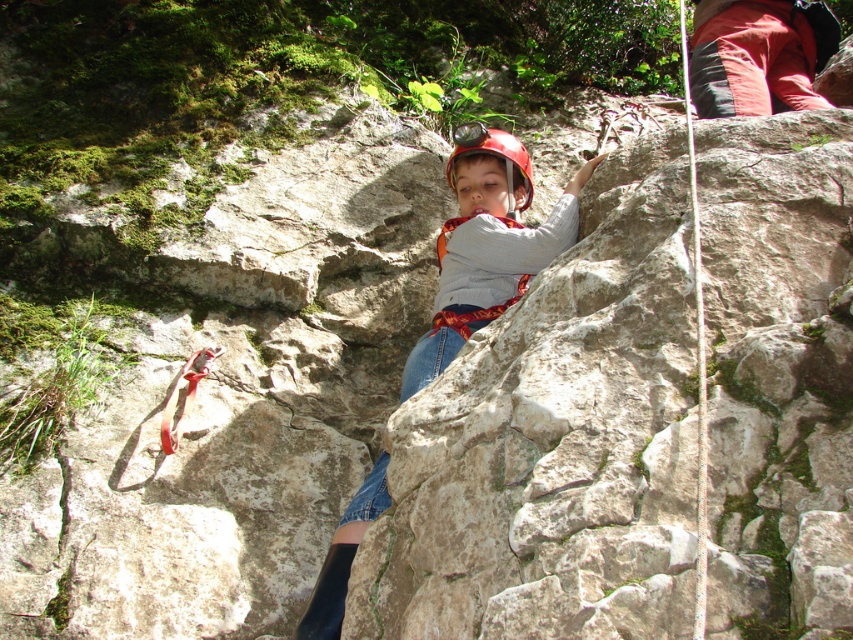
Can you confirm if red fabric jacket at upper right is smaller than red matte helmet at center?

Incorrect, red fabric jacket at upper right is not smaller in size than red matte helmet at center.

Can you confirm if red fabric jacket at upper right is positioned below red matte helmet at center?

No.

At what (x,y) coordinates should I click in order to perform the action: click on red fabric jacket at upper right. Please return your answer as a coordinate pair (x, y). Looking at the image, I should click on click(758, 54).

Image resolution: width=853 pixels, height=640 pixels. I want to click on red fabric jacket at upper right, so click(758, 54).

From the picture: Can you confirm if matte gray helmet at center is positioned below red matte helmet at center?

Indeed, matte gray helmet at center is positioned under red matte helmet at center.

Is matte gray helmet at center wider than red matte helmet at center?

Yes, matte gray helmet at center is wider than red matte helmet at center.

Is point (531, 186) positioned in front of point (447, 172)?

Yes, it is.

Where is `matte gray helmet at center`? The image size is (853, 640). matte gray helmet at center is located at coordinates (486, 243).

Is red fabric jacket at upper right thinner than white nylon rope at right?

Correct, red fabric jacket at upper right's width is less than white nylon rope at right's.

From the picture: Which is more to the left, red fabric jacket at upper right or white nylon rope at right?

white nylon rope at right is more to the left.

You are a GUI agent. You are given a task and a screenshot of the screen. Output one action in this format:
    pyautogui.click(x=<x>, y=<y>)
    Task: Click on the red fabric jacket at upper right
    This screenshot has height=640, width=853.
    Given the screenshot: What is the action you would take?
    pyautogui.click(x=758, y=54)